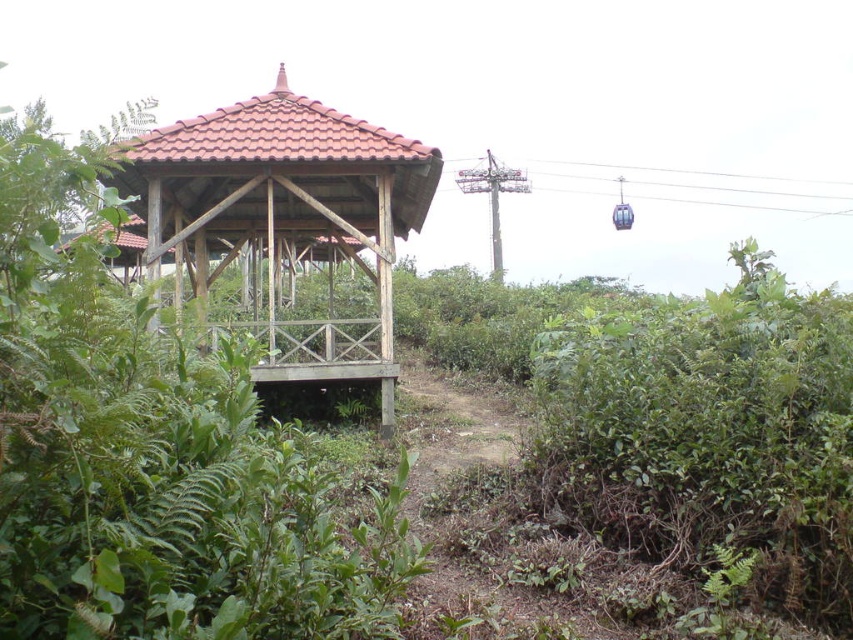
Consider the image. Does green leafy bush at lower right have a greater width compared to wooden gazebo at center?

Incorrect, green leafy bush at lower right's width does not surpass wooden gazebo at center's.

From the picture: Which is below, green leafy bush at lower right or wooden gazebo at center?

green leafy bush at lower right

Is point (851, 564) farther from camera compared to point (291, 257)?

No, (851, 564) is in front of (291, 257).

Where is `green leafy bush at lower right`? green leafy bush at lower right is located at coordinates (711, 433).